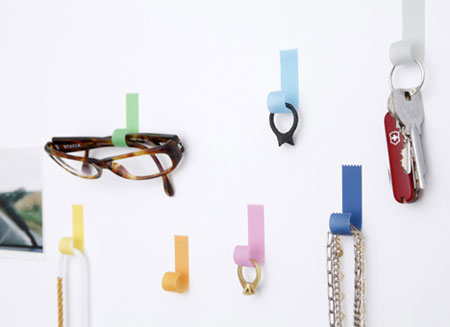
The width and height of the screenshot is (450, 327). What are the coordinates of `blue hook` in the screenshot? It's located at click(x=354, y=209).